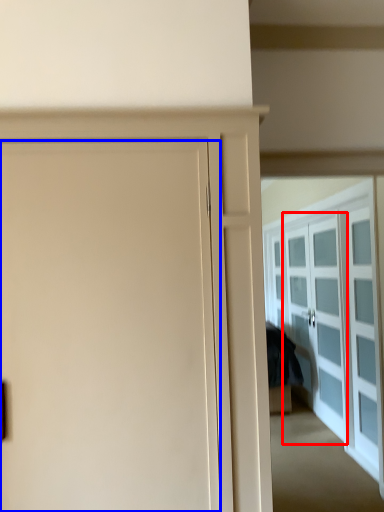
Question: Which of the following is the closest to the observer, screen door (highlighted by a red box) or door (highlighted by a blue box)?

Choices:
 (A) screen door
 (B) door

Answer: (B)